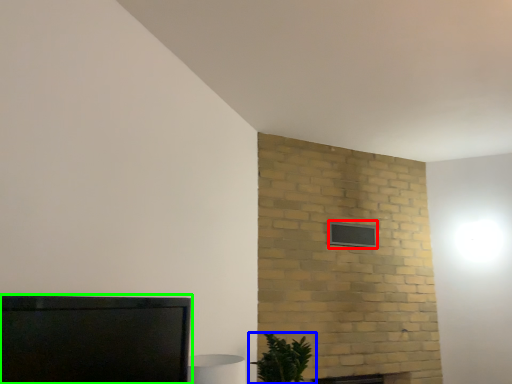
Question: Which object is the closest to the window (highlighted by a red box)? Choose among these: houseplant (highlighted by a blue box) or furniture (highlighted by a green box).

Choices:
 (A) houseplant
 (B) furniture

Answer: (A)